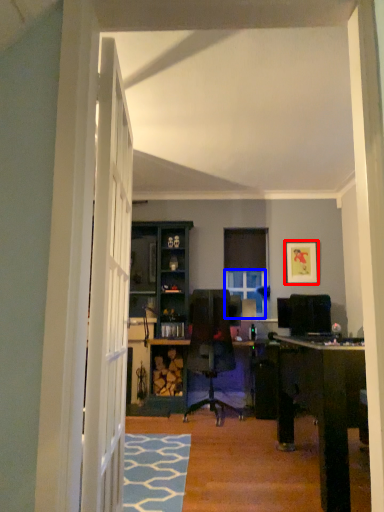
Question: Which of the following is the farthest to the observer, picture frame (highlighted by a red box) or window (highlighted by a blue box)?

Choices:
 (A) picture frame
 (B) window

Answer: (B)